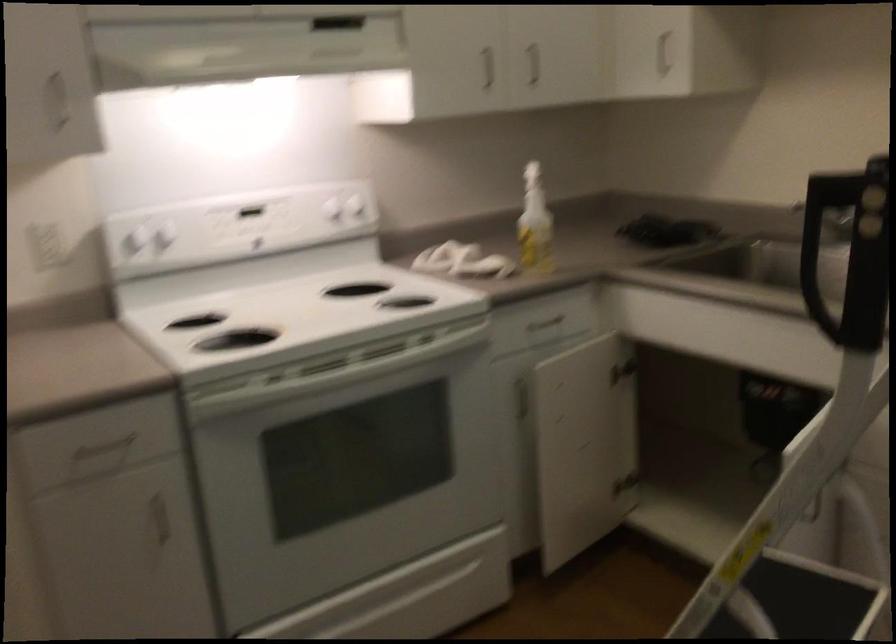
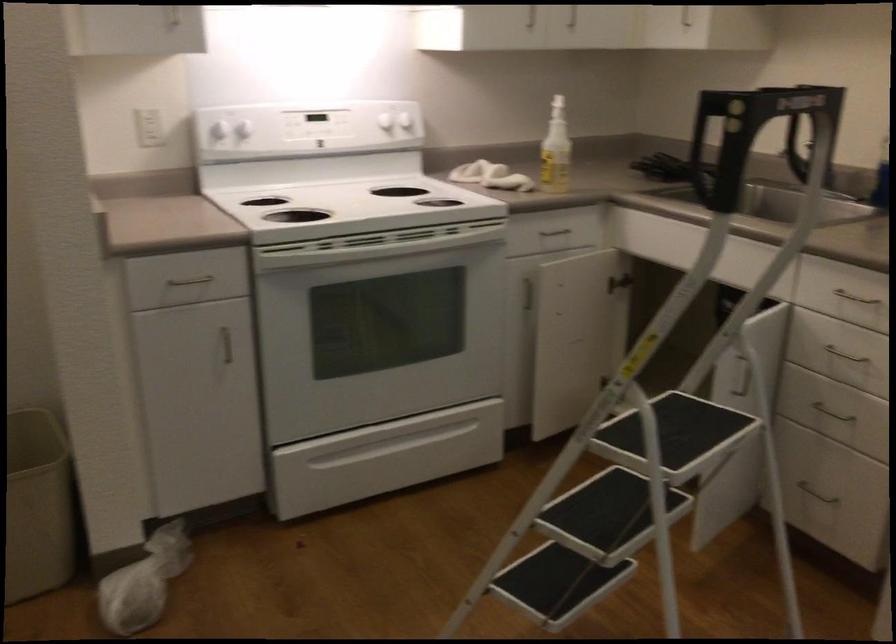
The point at (357, 204) is marked in the first image. Where is the corresponding point in the second image?

(403, 116)